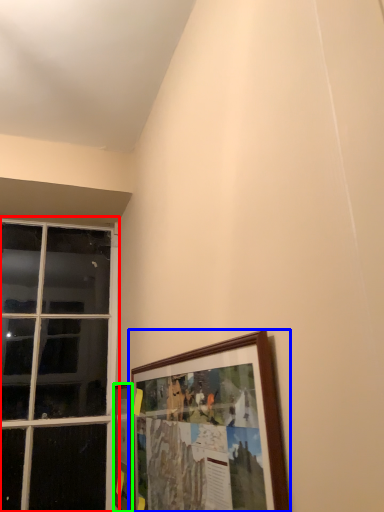
Question: Which object is the farthest from window (highlighted by a red box)? Choose among these: picture frame (highlighted by a blue box) or picture frame (highlighted by a green box).

Choices:
 (A) picture frame
 (B) picture frame

Answer: (A)